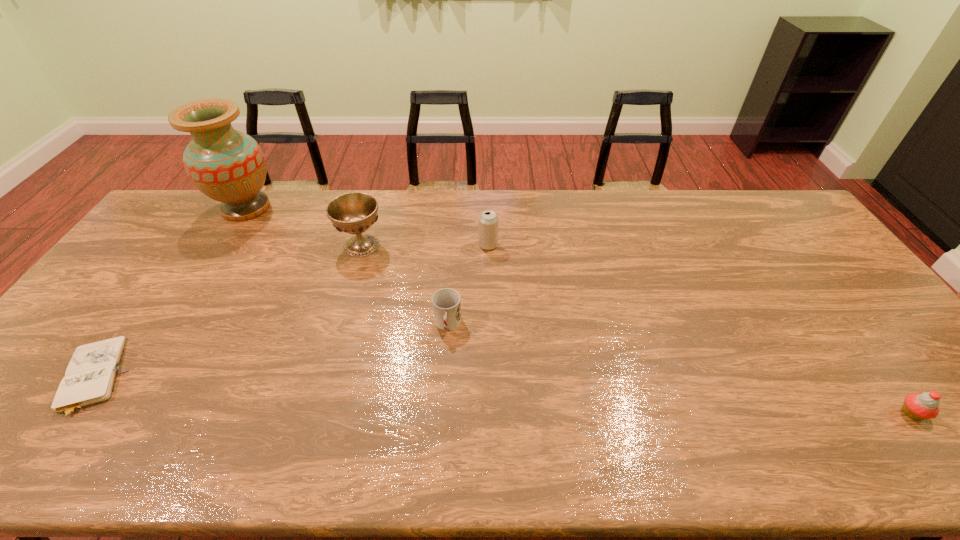
You are a GUI agent. You are given a task and a screenshot of the screen. Output one action in this format:
    pyautogui.click(x=<x>, y=<y>)
    Task: Click on the farthest object
    The image size is (960, 540).
    Given the screenshot: What is the action you would take?
    pyautogui.click(x=227, y=165)

Image resolution: width=960 pixels, height=540 pixels. I want to click on vase, so click(x=227, y=165).

Locate an element on the screen. This screenshot has width=960, height=540. chalice is located at coordinates (353, 213).

Locate an element on the screen. This screenshot has height=540, width=960. the third object from left to right is located at coordinates (353, 213).

Image resolution: width=960 pixels, height=540 pixels. Find the location of `beer can`. beer can is located at coordinates (488, 221).

Find the location of a particular element. The width and height of the screenshot is (960, 540). the fourth shortest object is located at coordinates (488, 221).

Locate an element on the screen. The image size is (960, 540). cup is located at coordinates (446, 303).

Where is `cupcake`? cupcake is located at coordinates (919, 406).

You are a GUI agent. You are given a task and a screenshot of the screen. Output one action in this format:
    pyautogui.click(x=<x>, y=<y>)
    Task: Click on the shortest object
    
    Given the screenshot: What is the action you would take?
    pyautogui.click(x=90, y=377)

In order to click on free region located on the right of the tallest object in this screenshot , I will do `click(352, 208)`.